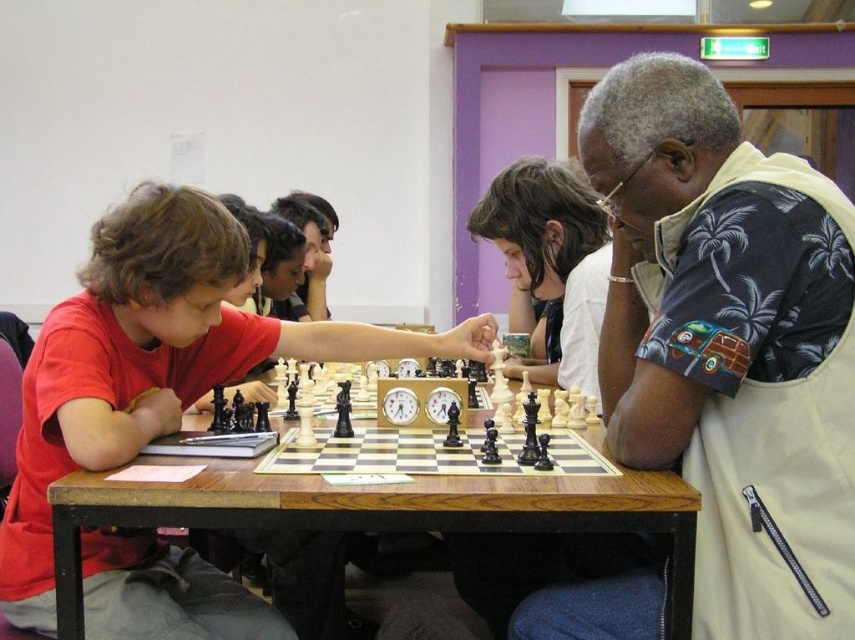
You are a chess player sitting at the table and see the two points on the chessboard labeled as point (691,125) and point (121,419). Which point is closer to you?

Point (691,125) is in front of point (121,419), so it is closer to you.

You are a photographer setting up for a chess match photo shoot. You need to ensure that the black floral shirt at right and the matte black chess set at center are both visible in the frame. Based on their heights, which object should you adjust your camera angle to focus on first to ensure both are in focus?

The black floral shirt at right is taller than the matte black chess set at center. To ensure both are in focus, adjust the camera angle to focus on the black floral shirt at right first, as it is taller and might require a lower angle to capture both objects effectively.